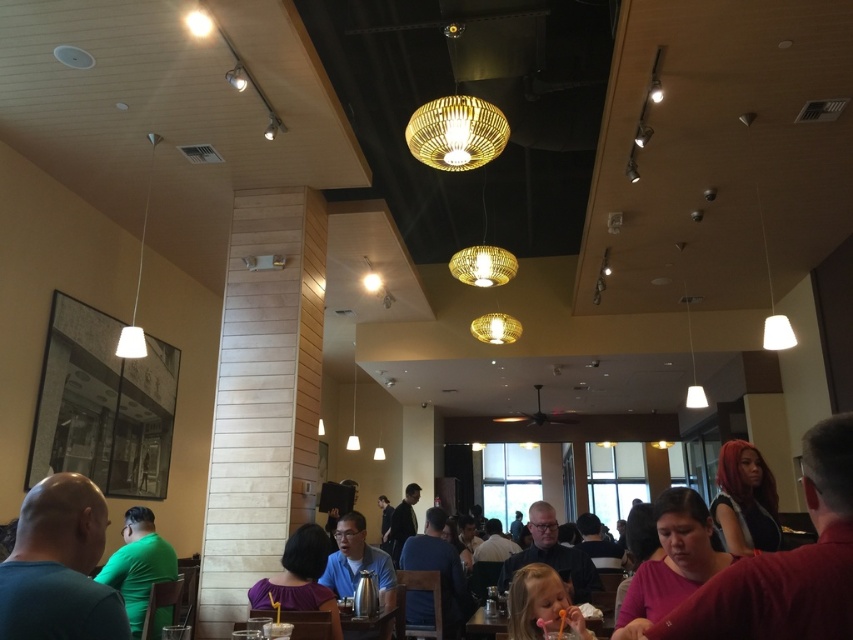
You are a customer at the restaurant and need to choose between placing your phone on the matte pink shirt at lower right or the smooth pink spoon at lower center. Which surface can accommodate your phone better based on their sizes?

The matte pink shirt at lower right has a greater width than the smooth pink spoon at lower center, so placing the phone on the matte pink shirt at lower right would be more suitable due to its larger surface area.

From the picture: You are a customer sitting at a table in the restaurant. You notice a matte pink shirt at lower right and a smooth pink spoon at lower center. Which object is closer to you?

The matte pink shirt at lower right is closer to you because it is in front of the smooth pink spoon at lower center.

You are a photographer taking a portrait of the matte pink shirt at lower right and the woven wood chandelier at upper center. Which object should you focus on first if you want to capture both in a single frame without moving the camera?

→ You should focus on the matte pink shirt at lower right first because it is larger in size than the woven wood chandelier at upper center, making it more prominent in the frame.